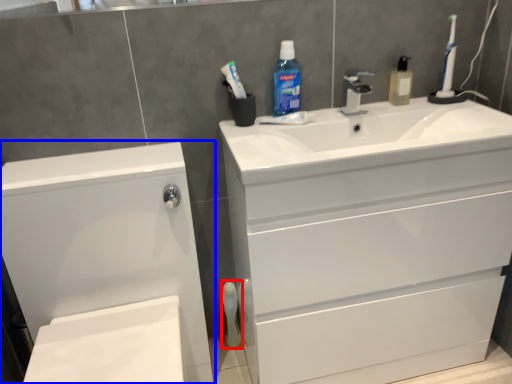
Question: Which of the following is the farthest to the observer, mouthwash (highlighted by a red box) or bathroom cabinet (highlighted by a blue box)?

Choices:
 (A) mouthwash
 (B) bathroom cabinet

Answer: (A)